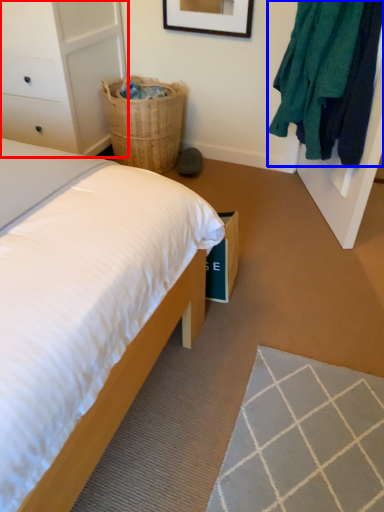
Question: Which of the following is the closest to the observer, dresser (highlighted by a red box) or clothing (highlighted by a blue box)?

Choices:
 (A) dresser
 (B) clothing

Answer: (B)